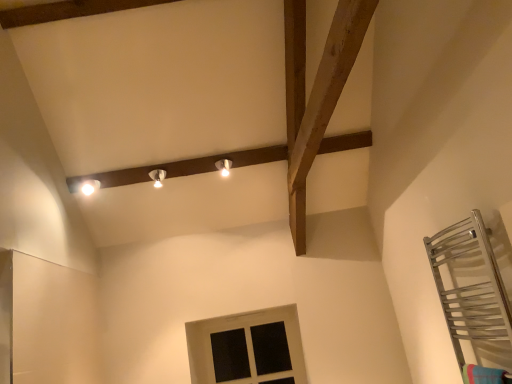
Where is `white painted wood window at lower center`? This screenshot has width=512, height=384. white painted wood window at lower center is located at coordinates (247, 348).

How much space does matte white light fixture at upper center, marked as the first light fixture in a right-to-left arrangement, occupy horizontally?

matte white light fixture at upper center, marked as the first light fixture in a right-to-left arrangement, is 11.07 centimeters wide.

Where is `white painted wood window at lower center`? white painted wood window at lower center is located at coordinates (247, 348).

Is matte white light fixture at upper left, the 3th light fixture in the right-to-left sequence, facing away from matte white light fixture at center, which appears as the 2th light fixture when viewed from the left?

No, matte white light fixture at upper left, the 3th light fixture in the right-to-left sequence,'s orientation is not away from matte white light fixture at center, which appears as the 2th light fixture when viewed from the left.

How different are the orientations of matte white light fixture at upper left, the 1th light fixture from the left, and matte white light fixture at center, the 2th light fixture from the right, in degrees?

There is a 0.00157-degree angle between the facing directions of matte white light fixture at upper left, the 1th light fixture from the left, and matte white light fixture at center, the 2th light fixture from the right.

Is matte white light fixture at upper left, the 3th light fixture in the right-to-left sequence, taller or shorter than matte white light fixture at center, the 2th light fixture from the right?

matte white light fixture at upper left, the 3th light fixture in the right-to-left sequence, is shorter than matte white light fixture at center, the 2th light fixture from the right.

Does matte white light fixture at center, which appears as the 2th light fixture when viewed from the left, turn towards matte white light fixture at upper left, the 1th light fixture from the left?

No, matte white light fixture at center, which appears as the 2th light fixture when viewed from the left, is not aimed at matte white light fixture at upper left, the 1th light fixture from the left.

Which is further, (156, 169) or (80, 186)?

The point (80, 186) is farther from the camera.

Choose the correct answer: Is matte white light fixture at center, the 2th light fixture from the right, inside matte white light fixture at upper left, the 1th light fixture from the left, or outside it?

The correct answer is: outside.

From the image's perspective, which is below, matte white light fixture at center, which appears as the 2th light fixture when viewed from the left, or matte white light fixture at upper left, the 1th light fixture from the left?

matte white light fixture at upper left, the 1th light fixture from the left.

Which object is positioned more to the left, matte white light fixture at upper center, the third light fixture positioned from the left, or matte white light fixture at upper left, the 1th light fixture from the left?

From the viewer's perspective, matte white light fixture at upper left, the 1th light fixture from the left, appears more on the left side.

Can you confirm if matte white light fixture at upper center, marked as the first light fixture in a right-to-left arrangement, is wider than matte white light fixture at upper left, the 1th light fixture from the left?

No.

Between matte white light fixture at upper center, marked as the first light fixture in a right-to-left arrangement, and matte white light fixture at upper left, the 3th light fixture in the right-to-left sequence, which one has larger size?

Bigger between the two is matte white light fixture at upper left, the 3th light fixture in the right-to-left sequence.

This screenshot has width=512, height=384. I want to click on window located behind the matte white light fixture at center, the 2th light fixture from the right, so click(x=247, y=348).

Considering the sizes of matte white light fixture at center, the 2th light fixture from the right, and white painted wood window at lower center in the image, is matte white light fixture at center, the 2th light fixture from the right, wider or thinner than white painted wood window at lower center?

In the image, matte white light fixture at center, the 2th light fixture from the right, appears to be wider than white painted wood window at lower center.

From the image's perspective, which is below, matte white light fixture at center, the 2th light fixture from the right, or white painted wood window at lower center?

white painted wood window at lower center.

Between point (155, 169) and point (270, 376), which one is positioned behind?

The point (270, 376) is farther from the camera.

Which of these two, white painted wood window at lower center or matte white light fixture at center, the 2th light fixture from the right, is bigger?

Bigger between the two is white painted wood window at lower center.

Would you consider white painted wood window at lower center to be distant from matte white light fixture at center, which appears as the 2th light fixture when viewed from the left?

white painted wood window at lower center is positioned a significant distance from matte white light fixture at center, which appears as the 2th light fixture when viewed from the left.

Considering the relative positions of white painted wood window at lower center and matte white light fixture at center, which appears as the 2th light fixture when viewed from the left, in the image provided, is white painted wood window at lower center in front of matte white light fixture at center, which appears as the 2th light fixture when viewed from the left,?

No.

From the image's perspective, which one is positioned lower, white painted wood window at lower center or matte white light fixture at center, which appears as the 2th light fixture when viewed from the left?

white painted wood window at lower center, from the image's perspective.

Which of these two, matte white light fixture at upper left, the 3th light fixture in the right-to-left sequence, or white painted wood window at lower center, is smaller?

matte white light fixture at upper left, the 3th light fixture in the right-to-left sequence.

Which is more to the left, matte white light fixture at upper left, the 3th light fixture in the right-to-left sequence, or white painted wood window at lower center?

From the viewer's perspective, matte white light fixture at upper left, the 3th light fixture in the right-to-left sequence, appears more on the left side.

From a real-world perspective, is matte white light fixture at upper left, the 1th light fixture from the left, physically above white painted wood window at lower center?

Yes, from a real-world perspective, matte white light fixture at upper left, the 1th light fixture from the left, is above white painted wood window at lower center.

Which is behind, point (83, 188) or point (236, 381)?

Point (236, 381)

I want to click on window that appears behind the matte white light fixture at upper center, the third light fixture positioned from the left, so click(x=247, y=348).

Does point (218, 320) appear closer or farther from the camera than point (227, 175)?

Point (218, 320).

Is white painted wood window at lower center wider or thinner than matte white light fixture at upper center, marked as the first light fixture in a right-to-left arrangement?

Clearly, white painted wood window at lower center has less width compared to matte white light fixture at upper center, marked as the first light fixture in a right-to-left arrangement.

Is white painted wood window at lower center facing towards matte white light fixture at upper center, marked as the first light fixture in a right-to-left arrangement?

No, white painted wood window at lower center is not turned towards matte white light fixture at upper center, marked as the first light fixture in a right-to-left arrangement.

Find the location of a particular element. The image size is (512, 384). light fixture in front of the matte white light fixture at center, the 2th light fixture from the right is located at coordinates (90, 186).

The height and width of the screenshot is (384, 512). Find the location of `the 1st light fixture behind when counting from the matte white light fixture at upper left, the 1th light fixture from the left`. the 1st light fixture behind when counting from the matte white light fixture at upper left, the 1th light fixture from the left is located at coordinates (158, 177).

Estimate the real-world distances between objects in this image. Which object is further from white painted wood window at lower center, matte white light fixture at center, which appears as the 2th light fixture when viewed from the left, or matte white light fixture at upper left, the 1th light fixture from the left?

matte white light fixture at upper left, the 1th light fixture from the left, is further to white painted wood window at lower center.

Consider the image. Estimate the real-world distances between objects in this image. Which object is closer to matte white light fixture at upper left, the 1th light fixture from the left, matte white light fixture at upper center, marked as the first light fixture in a right-to-left arrangement, or white painted wood window at lower center?

matte white light fixture at upper center, marked as the first light fixture in a right-to-left arrangement, is positioned closer to the anchor matte white light fixture at upper left, the 1th light fixture from the left.

When comparing their distances from white painted wood window at lower center, does matte white light fixture at center, the 2th light fixture from the right, or matte white light fixture at upper center, the third light fixture positioned from the left, seem further?

Based on the image, matte white light fixture at center, the 2th light fixture from the right, appears to be further to white painted wood window at lower center.

Which object lies nearer to the anchor point white painted wood window at lower center, matte white light fixture at upper center, the third light fixture positioned from the left, or matte white light fixture at upper left, the 3th light fixture in the right-to-left sequence?

matte white light fixture at upper center, the third light fixture positioned from the left, is positioned closer to the anchor white painted wood window at lower center.

When comparing their distances from matte white light fixture at upper left, the 1th light fixture from the left, does matte white light fixture at upper center, the third light fixture positioned from the left, or matte white light fixture at center, the 2th light fixture from the right, seem further?

matte white light fixture at upper center, the third light fixture positioned from the left, lies further to matte white light fixture at upper left, the 1th light fixture from the left, than the other object.

Consider the image. Considering their positions, is matte white light fixture at upper left, the 1th light fixture from the left, positioned closer to matte white light fixture at upper center, the third light fixture positioned from the left, than white painted wood window at lower center?

matte white light fixture at upper left, the 1th light fixture from the left, is closer to matte white light fixture at upper center, the third light fixture positioned from the left.

Considering their positions, is white painted wood window at lower center positioned closer to matte white light fixture at upper left, the 1th light fixture from the left, than matte white light fixture at upper center, the third light fixture positioned from the left?

matte white light fixture at upper center, the third light fixture positioned from the left, is positioned closer to the anchor matte white light fixture at upper left, the 1th light fixture from the left.

Looking at the image, which one is located closer to matte white light fixture at center, which appears as the 2th light fixture when viewed from the left, white painted wood window at lower center or matte white light fixture at upper left, the 1th light fixture from the left?

Based on the image, matte white light fixture at upper left, the 1th light fixture from the left, appears to be nearer to matte white light fixture at center, which appears as the 2th light fixture when viewed from the left.

In order to click on light fixture between matte white light fixture at upper left, the 1th light fixture from the left, and matte white light fixture at upper center, marked as the first light fixture in a right-to-left arrangement in this screenshot , I will do `click(158, 177)`.

The height and width of the screenshot is (384, 512). I want to click on light fixture that lies between matte white light fixture at center, which appears as the 2th light fixture when viewed from the left, and white painted wood window at lower center from top to bottom, so pos(90,186).